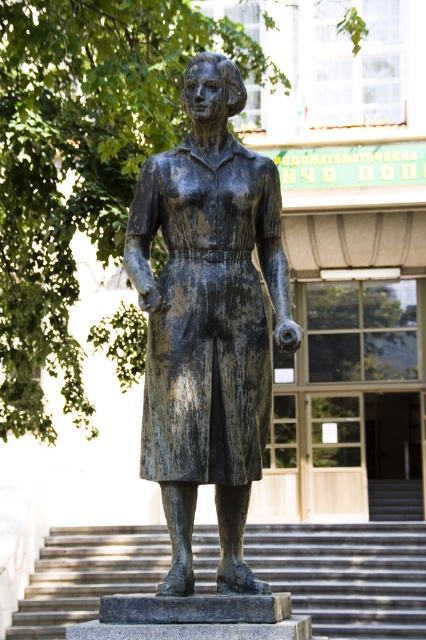
Looking at this image, you are an art conservator assessing the space around the bronze statue at center and the smooth concrete stairs at center. Based on their widths, which object would require more material for a protective covering?

The smooth concrete stairs at center require more material for a protective covering because they are wider than the bronze statue at center.

You are a maintenance worker needing to clean the bronze statue at center. You see the smooth concrete stairs at center leading up to it. Can you reach the statue using the stairs?

The bronze statue at center is above the smooth concrete stairs at center, so yes, you can reach the statue by climbing the stairs.